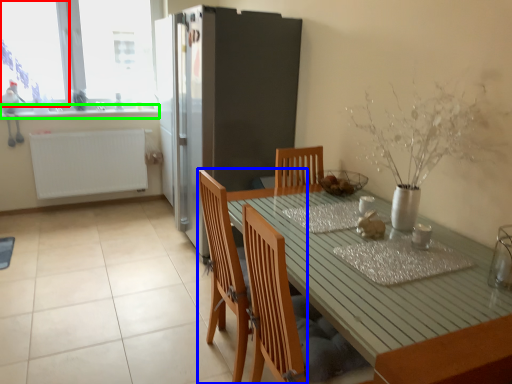
Question: Which object is the closest to the window screen (highlighted by a red box)? Choose among these: chair (highlighted by a blue box) or counter top (highlighted by a green box).

Choices:
 (A) chair
 (B) counter top

Answer: (B)